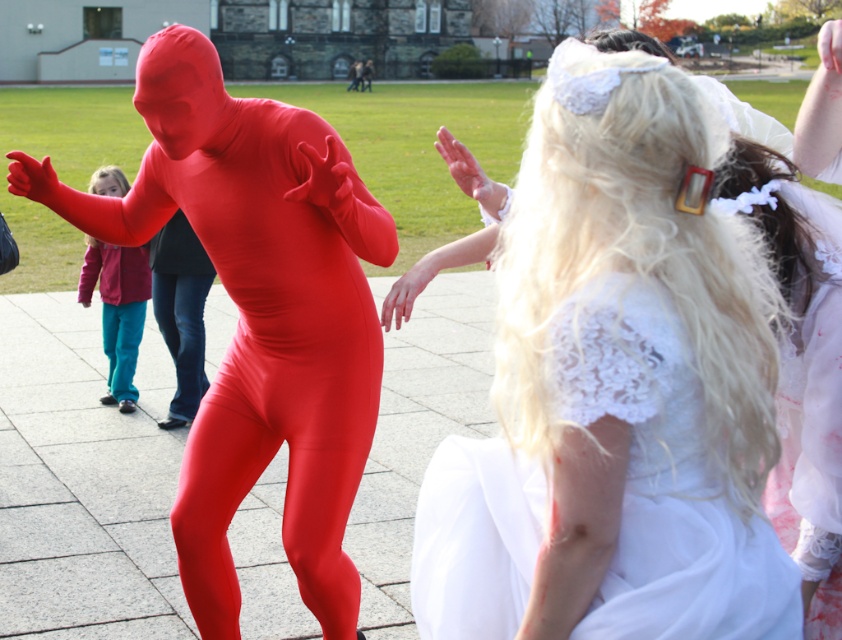
Based on the photo, you are a photographer at the event and need to capture both the matte red suit at left and the white lace dress at upper right in a single frame. Given the size difference between them, which one might you need to position closer to the camera to ensure both appear balanced in size in the photo?

Since the matte red suit at left is larger in size than the white lace dress at upper right, you should position the white lace dress at upper right closer to the camera to make them appear similar in size in the photo.

You are a photographer trying to capture the matte red suit at left and the person in white lace dress at right in the same frame. Based on their positions, can you fit both subjects into your camera viewfinder without moving your position?

The matte red suit at left is located at point (256, 314) and the person in white lace dress at right is at point (256, 324). Since their coordinates are very close horizontally, they can likely be captured in the same frame without moving your position.